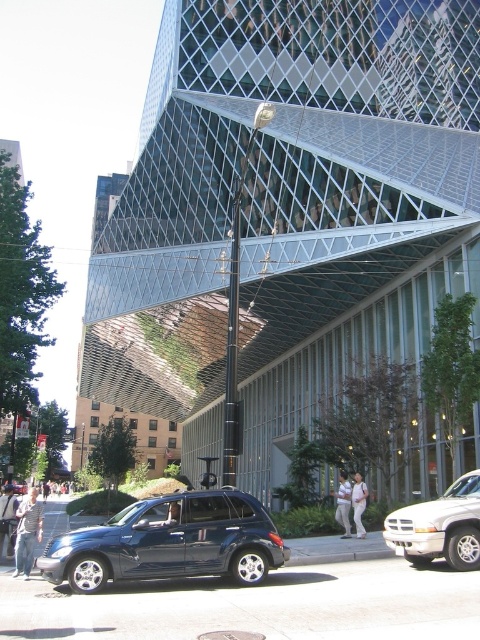
You are a delivery driver who needs to park your vehicle in this area. Your truck is 20 feet long. There is a matte dark blue suv at lower left and a shiny dark blue sedan at center. Can you safely park your truck between them without overlapping either vehicle?

The matte dark blue suv at lower left is 169.50 feet from the shiny dark blue sedan at center. Since your truck is only 20 feet long, there is ample space between them to park safely without overlapping either vehicle.